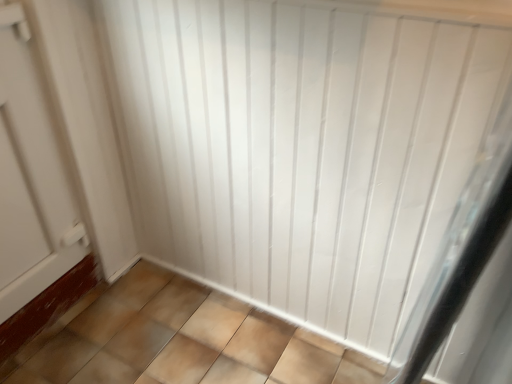
The width and height of the screenshot is (512, 384). What do you see at coordinates (31, 176) in the screenshot?
I see `white matte door at left` at bounding box center [31, 176].

Locate an element on the screen. white matte door at left is located at coordinates (31, 176).

Locate an element on the screen. This screenshot has width=512, height=384. white matte door at left is located at coordinates (31, 176).